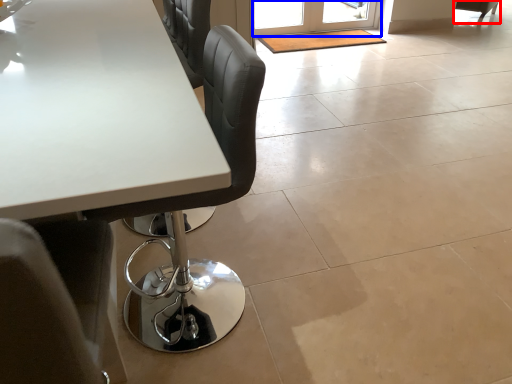
Question: Which point is closer to the camera, chair (highlighted by a red box) or screen door (highlighted by a blue box)?

Choices:
 (A) chair
 (B) screen door

Answer: (B)